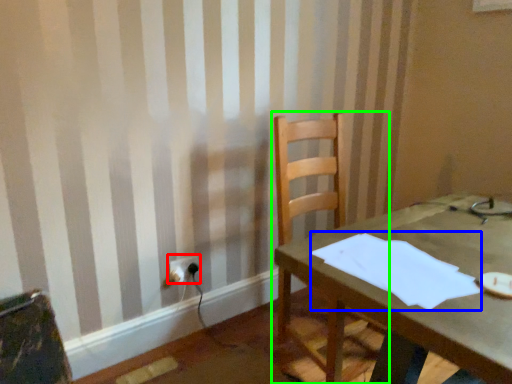
Question: Which is farther away from electric outlet (highlighted by a red box)? paper (highlighted by a blue box) or chair (highlighted by a green box)?

Choices:
 (A) paper
 (B) chair

Answer: (A)